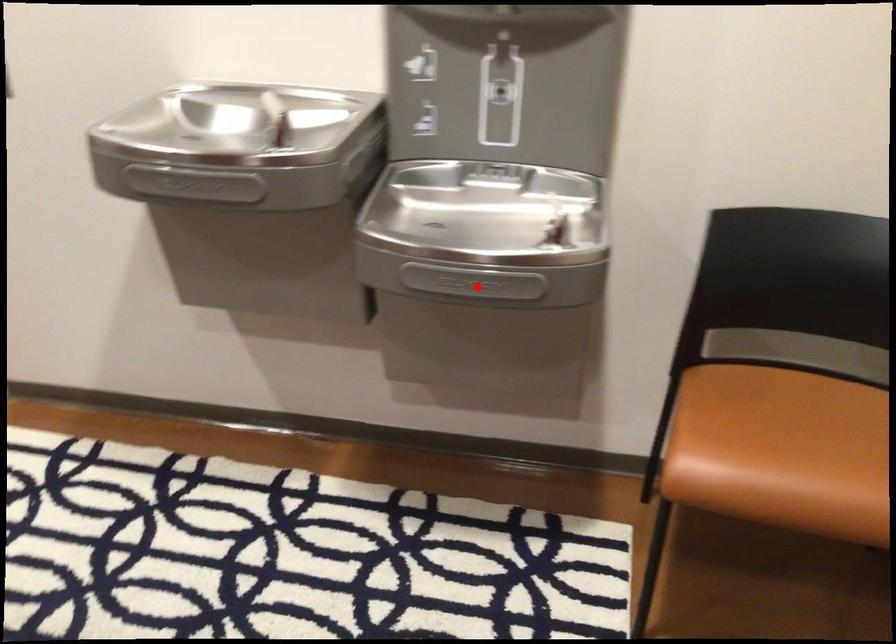
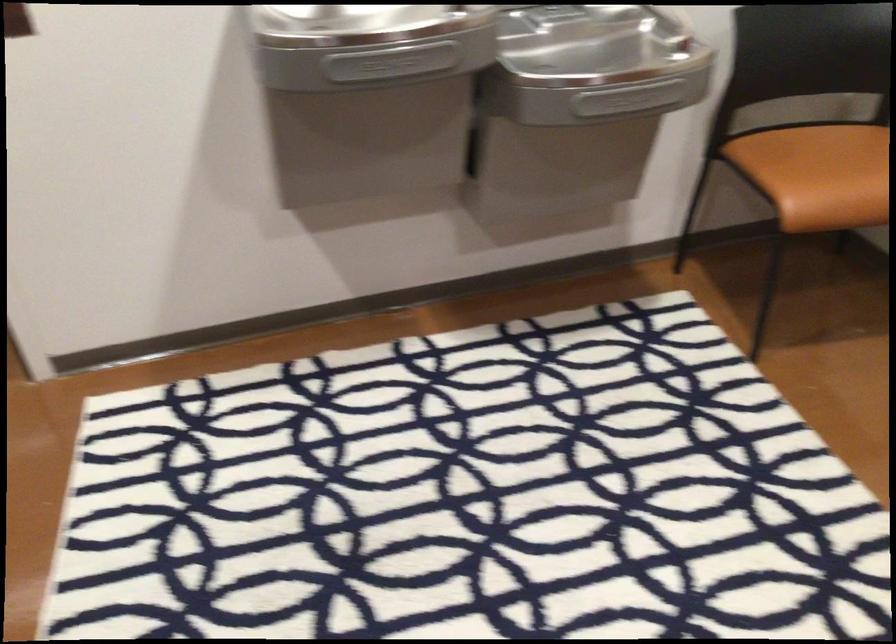
In the second image, find the point that corresponds to the highlighted location in the first image.

(627, 99)